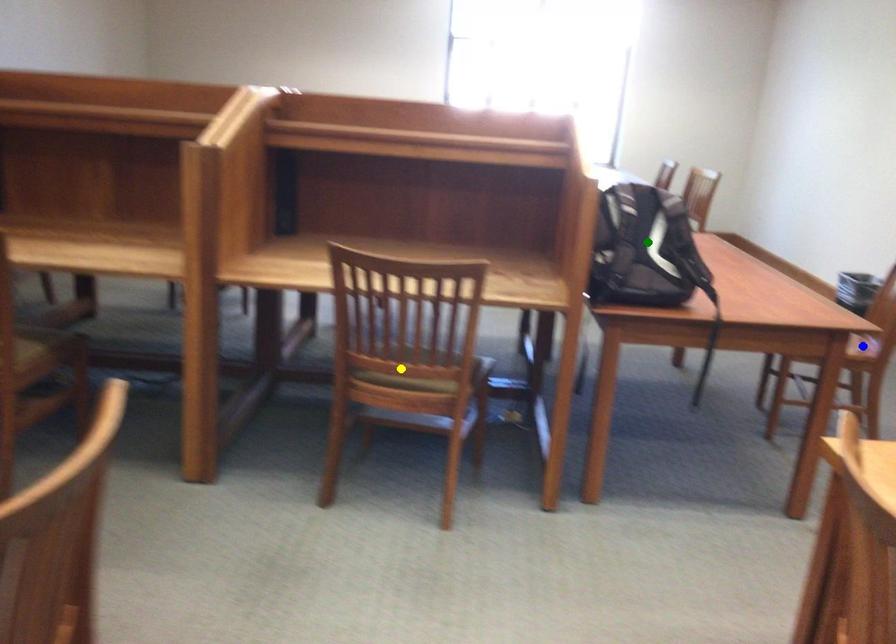
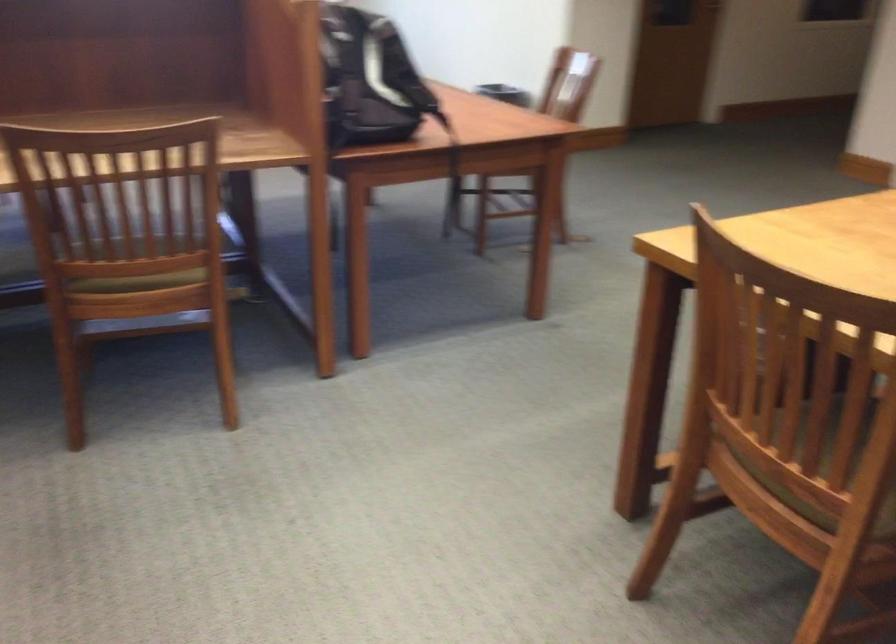
I am providing you with two images of the same scene from different viewpoints. Three points are marked in image1. Which point corresponds to a part or object that is occluded in image2?In image1, three points are marked. Which of them correspond to a part or object that is occluded in image2?Among the three points shown in image1, which one corresponds to a part or object that is no longer visible due to occlusion in image2?

Invisible in image2: blue point.